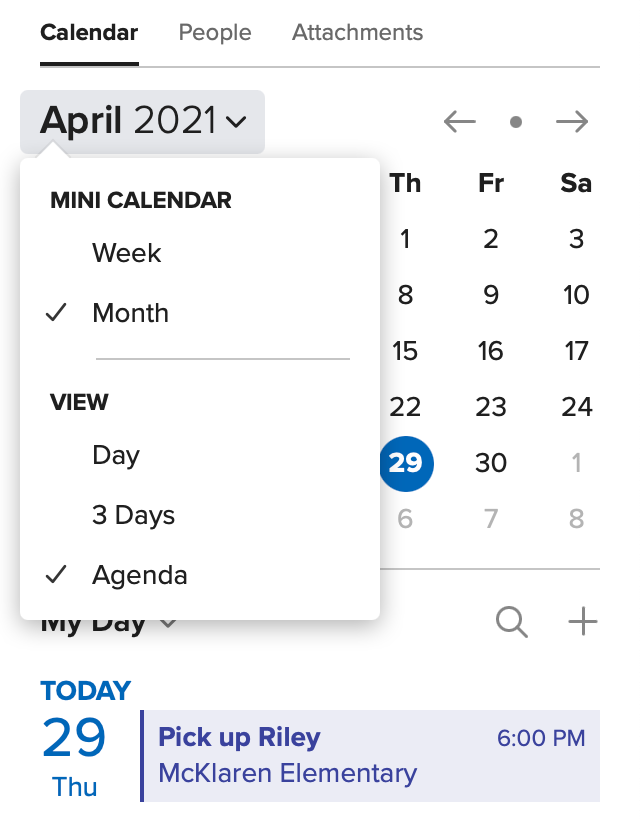
Locate an element on the screen. This screenshot has height=820, width=640. calendar is located at coordinates (168, 197), (93, 28).